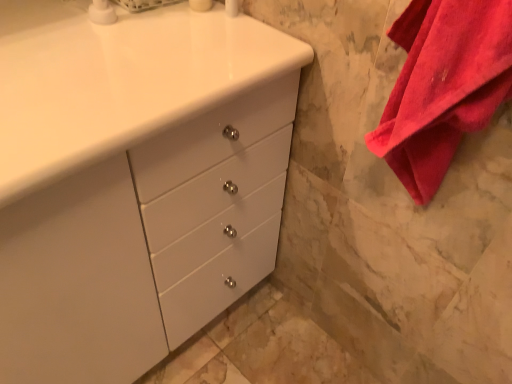
Question: From the image's perspective, is white glossy soap dispenser at upper left below red cotton towel at right?

Choices:
 (A) no
 (B) yes

Answer: (A)

Question: Considering the relative positions of white glossy soap dispenser at upper left and red cotton towel at right in the image provided, is white glossy soap dispenser at upper left to the left of red cotton towel at right from the viewer's perspective?

Choices:
 (A) no
 (B) yes

Answer: (B)

Question: Is white glossy soap dispenser at upper left not close to red cotton towel at right?

Choices:
 (A) yes
 (B) no

Answer: (B)

Question: Can you confirm if white glossy soap dispenser at upper left is smaller than red cotton towel at right?

Choices:
 (A) yes
 (B) no

Answer: (A)

Question: Is white glossy soap dispenser at upper left oriented towards red cotton towel at right?

Choices:
 (A) yes
 (B) no

Answer: (B)

Question: Is point (108, 23) positioned closer to the camera than point (48, 334)?

Choices:
 (A) farther
 (B) closer

Answer: (A)

Question: In terms of size, does white glossy soap dispenser at upper left appear bigger or smaller than white glossy cabinet at center?

Choices:
 (A) big
 (B) small

Answer: (B)

Question: From their relative heights in the image, would you say white glossy soap dispenser at upper left is taller or shorter than white glossy cabinet at center?

Choices:
 (A) short
 (B) tall

Answer: (A)

Question: In the image, is white glossy soap dispenser at upper left positioned in front of or behind white glossy cabinet at center?

Choices:
 (A) front
 (B) behind

Answer: (B)

Question: Based on their positions, is red cotton towel at right located to the left or right of white glossy soap dispenser at upper left?

Choices:
 (A) right
 (B) left

Answer: (A)

Question: In terms of height, does red cotton towel at right look taller or shorter compared to white glossy soap dispenser at upper left?

Choices:
 (A) tall
 (B) short

Answer: (A)

Question: Considering the positions of red cotton towel at right and white glossy soap dispenser at upper left in the image, is red cotton towel at right wider or thinner than white glossy soap dispenser at upper left?

Choices:
 (A) wide
 (B) thin

Answer: (A)

Question: Looking at the image, does red cotton towel at right seem bigger or smaller compared to white glossy soap dispenser at upper left?

Choices:
 (A) small
 (B) big

Answer: (B)

Question: Based on their positions, is white glossy cabinet at center located to the left or right of white glossy soap dispenser at upper left?

Choices:
 (A) right
 (B) left

Answer: (B)

Question: From a real-world perspective, is white glossy cabinet at center physically located above or below white glossy soap dispenser at upper left?

Choices:
 (A) below
 (B) above

Answer: (A)